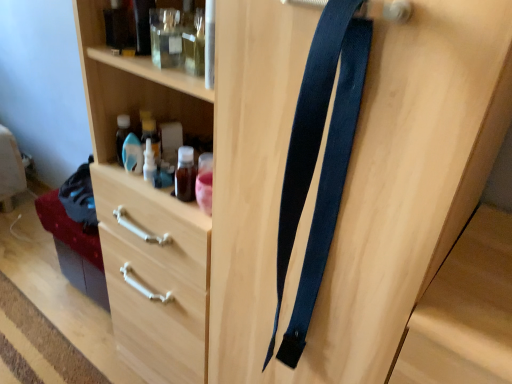
Image resolution: width=512 pixels, height=384 pixels. In order to click on blank space above wooden drawer at lower left (from a real-world perspective) in this screenshot , I will do [40, 286].